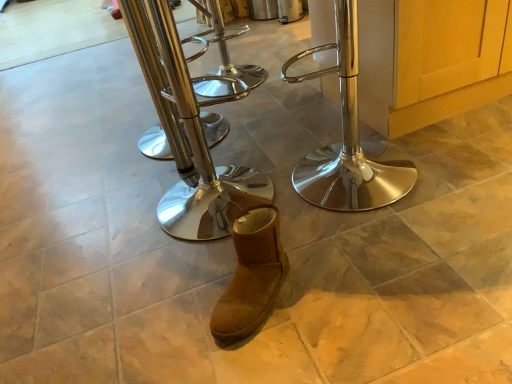
You are a GUI agent. You are given a task and a screenshot of the screen. Output one action in this format:
    pyautogui.click(x=<x>, y=<y>)
    Task: Click on the vacant area located to the right-hand side of polished chrome stool at center, the second step stool viewed from the right
    The height and width of the screenshot is (384, 512).
    Given the screenshot: What is the action you would take?
    pyautogui.click(x=293, y=198)